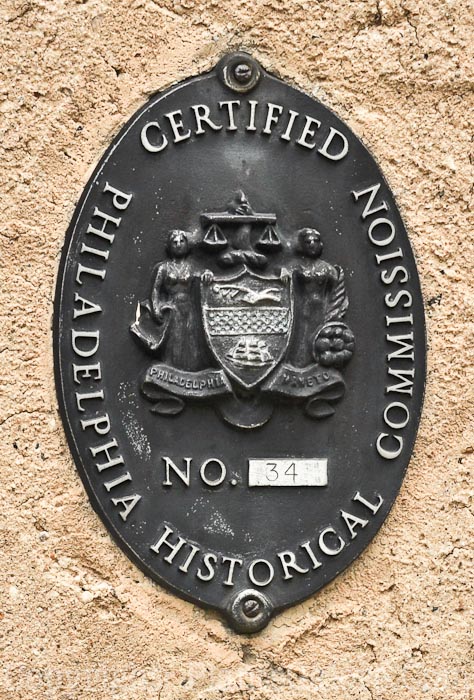
Where is `plaque`? This screenshot has width=474, height=700. plaque is located at coordinates (219, 554).